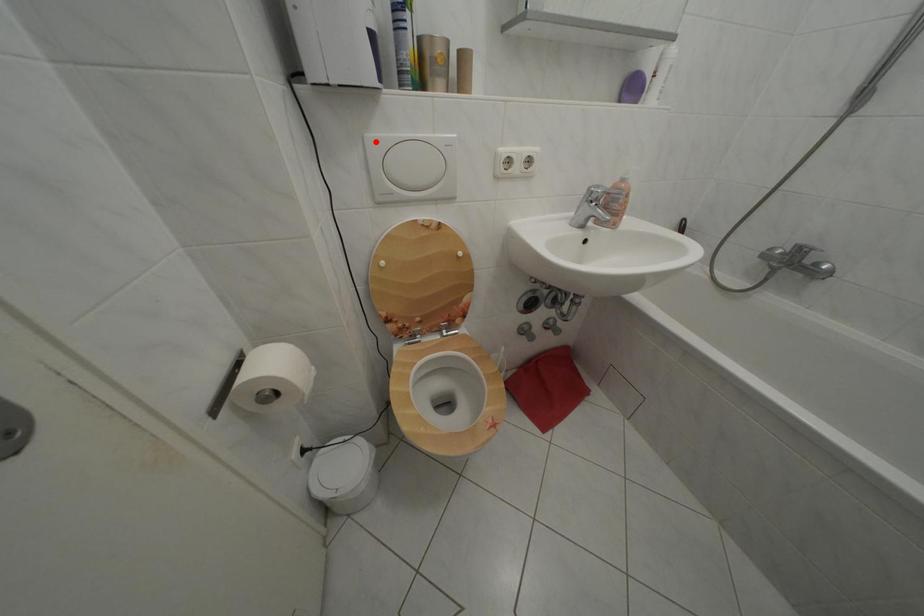
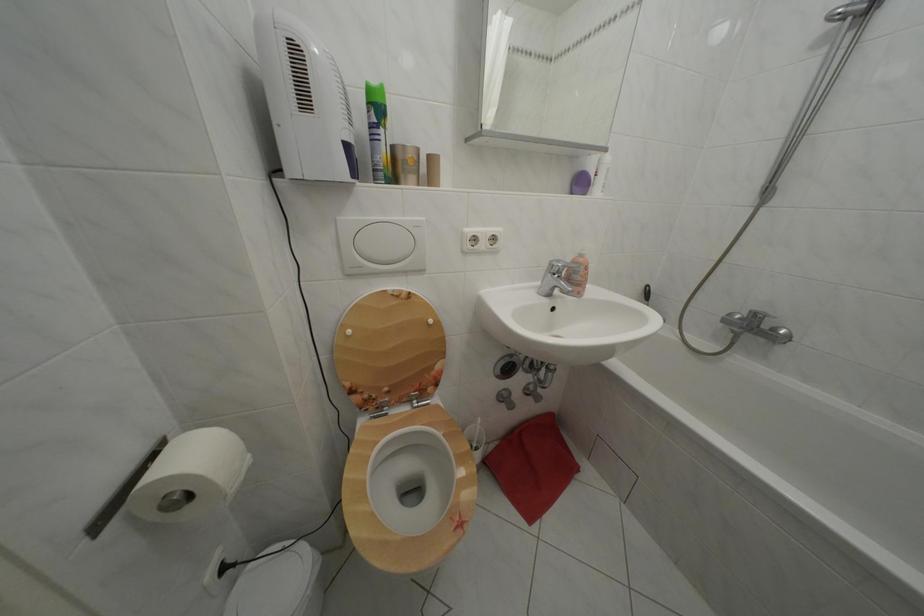
In the second image, find the point that corresponds to the highlighted location in the first image.

(348, 225)